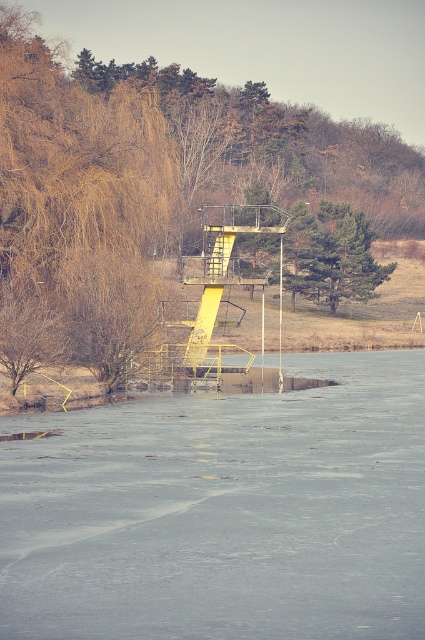
Question: Which point is farther to the camera?

Choices:
 (A) (101, 166)
 (B) (105, 550)
 (C) (314, 294)

Answer: (C)

Question: Which is farther from the green textured tree at center?

Choices:
 (A) brown leafy tree at upper left
 (B) transparent ice at center

Answer: (B)

Question: Can you confirm if transparent ice at center is bigger than brown leafy tree at upper left?

Choices:
 (A) no
 (B) yes

Answer: (A)

Question: Where is transparent ice at center located in relation to brown leafy tree at upper left in the image?

Choices:
 (A) below
 (B) above

Answer: (A)

Question: Is transparent ice at center to the left of green textured tree at center from the viewer's perspective?

Choices:
 (A) yes
 (B) no

Answer: (A)

Question: Among these points, which one is farthest from the camera?

Choices:
 (A) (376, 385)
 (B) (325, 237)

Answer: (B)